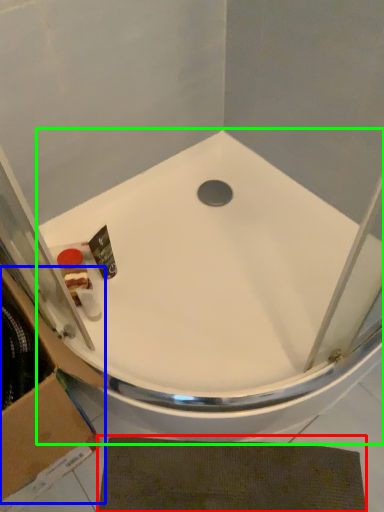
Question: Which is nearer to the bath mat (highlighted by a red box)? cardboard box (highlighted by a blue box) or bathtub (highlighted by a green box).

Choices:
 (A) cardboard box
 (B) bathtub

Answer: (A)